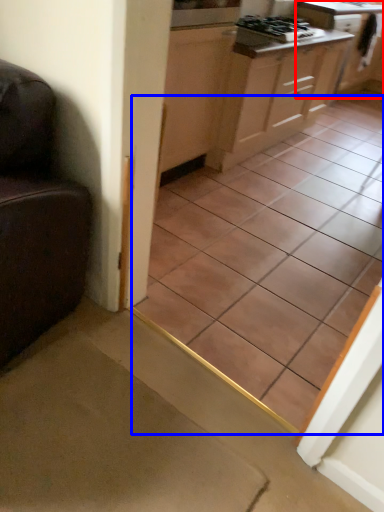
Question: Which of the following is the closest to the observer, cabinetry (highlighted by a red box) or ceramic tile (highlighted by a blue box)?

Choices:
 (A) cabinetry
 (B) ceramic tile

Answer: (B)